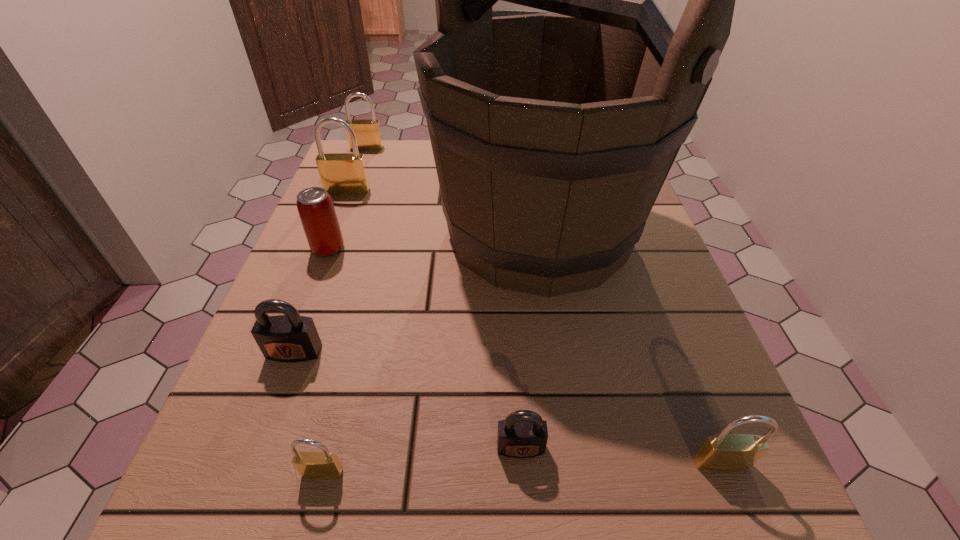
Locate an element on the screen. vacant space situated 0.050m on the front of the smaller gray padlock near the keyhole is located at coordinates (524, 499).

Image resolution: width=960 pixels, height=540 pixels. In order to click on bucket that is at the far edge in this screenshot , I will do `click(552, 135)`.

Locate an element on the screen. object that is positioned at the near edge is located at coordinates pyautogui.click(x=310, y=465).

Find the location of a particular element. This screenshot has height=540, width=960. beer can that is at the left edge is located at coordinates (315, 207).

This screenshot has width=960, height=540. In order to click on bucket that is at the right edge in this screenshot , I will do pyautogui.click(x=552, y=135).

Where is `padlock at the right edge`? The height and width of the screenshot is (540, 960). padlock at the right edge is located at coordinates (724, 452).

You are a GUI agent. You are given a task and a screenshot of the screen. Output one action in this format:
    pyautogui.click(x=<x>, y=<y>)
    Task: Click on the object that is at the near left corner
    The width and height of the screenshot is (960, 540).
    Given the screenshot: What is the action you would take?
    pyautogui.click(x=310, y=465)

You are a GUI agent. You are given a task and a screenshot of the screen. Output one action in this format:
    pyautogui.click(x=<x>, y=<y>)
    Task: Click on the object that is at the far right corner
    
    Given the screenshot: What is the action you would take?
    pyautogui.click(x=552, y=135)

This screenshot has height=540, width=960. Find the location of `free space at the far edge of the desktop`. free space at the far edge of the desktop is located at coordinates (405, 150).

In the image, there is a desktop. Where is `vacant space at the near edge`? The width and height of the screenshot is (960, 540). vacant space at the near edge is located at coordinates click(474, 490).